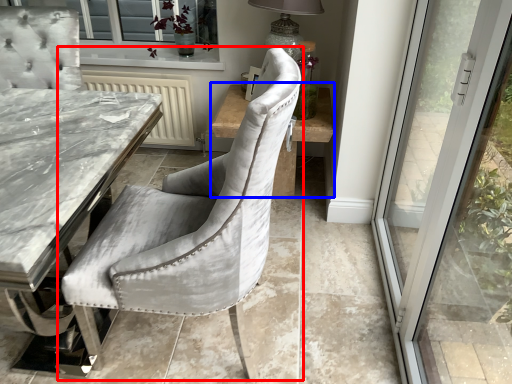
Question: Which object is further to the camera taking this photo, chair (highlighted by a red box) or side table (highlighted by a blue box)?

Choices:
 (A) chair
 (B) side table

Answer: (B)